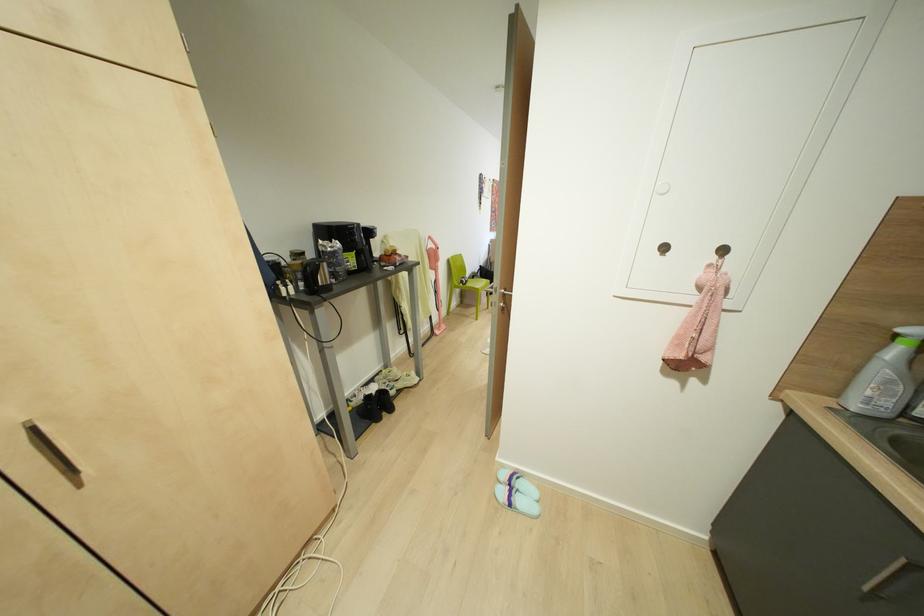
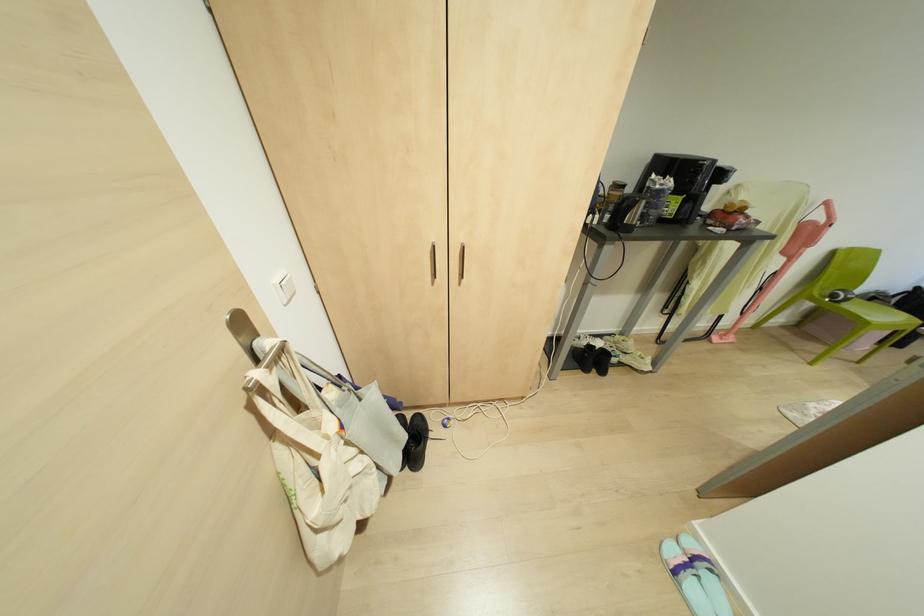
Find the pixel in the second image that matches point 429,237 in the first image.

(825, 203)